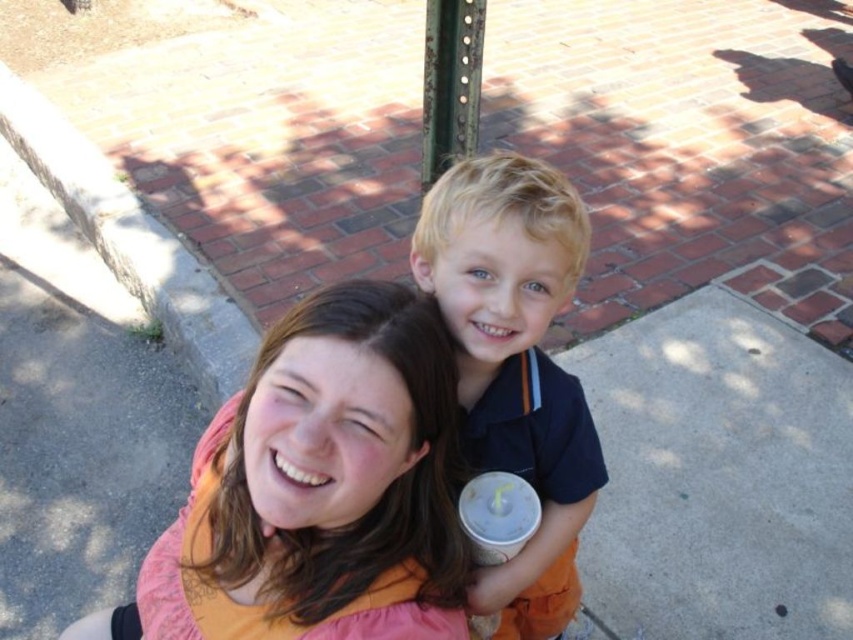
Does matte orange shirt at center come in front of white paper cup at center?

That is True.

The image size is (853, 640). In order to click on matte orange shirt at center in this screenshot , I will do click(332, 467).

Which is behind, point (448, 492) or point (556, 216)?

Positioned behind is point (448, 492).

Between point (409, 358) and point (544, 544), which one is positioned in front?

Point (409, 358) is in front.

Is point (393, 353) positioned before point (585, 244)?

That is True.

Where is `matte orange shirt at center`? This screenshot has width=853, height=640. matte orange shirt at center is located at coordinates (332, 467).

Between point (496, 588) and point (531, 500), which one is positioned in front?

Positioned in front is point (531, 500).

Which is behind, point (465, 397) or point (498, 508)?

The point (465, 397) is more distant.

What do you see at coordinates (515, 364) in the screenshot?
I see `blonde hair boy at center` at bounding box center [515, 364].

You are a GUI agent. You are given a task and a screenshot of the screen. Output one action in this format:
    pyautogui.click(x=<x>, y=<y>)
    Task: Click on the blonde hair boy at center
    This screenshot has width=853, height=640.
    Given the screenshot: What is the action you would take?
    pyautogui.click(x=515, y=364)